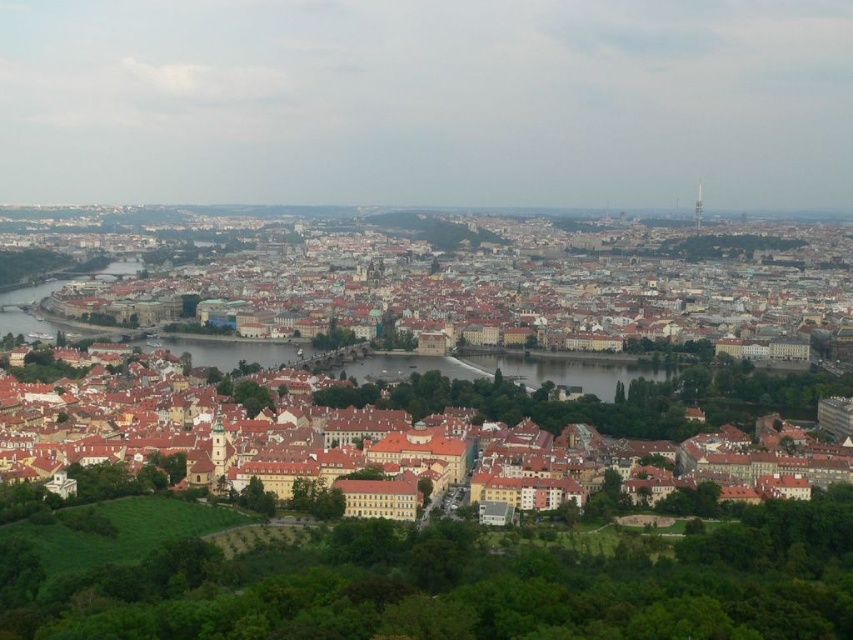
Does brown tiled roofs at center have a greater height compared to brown textured buildings at center?

Yes, brown tiled roofs at center is taller than brown textured buildings at center.

Which is more to the left, brown tiled roofs at center or brown textured buildings at center?

From the viewer's perspective, brown textured buildings at center appears more on the left side.

Find the location of a particular element. Image resolution: width=853 pixels, height=640 pixels. brown tiled roofs at center is located at coordinates (503, 284).

Where is `brown tiled roofs at center`? brown tiled roofs at center is located at coordinates (503, 284).